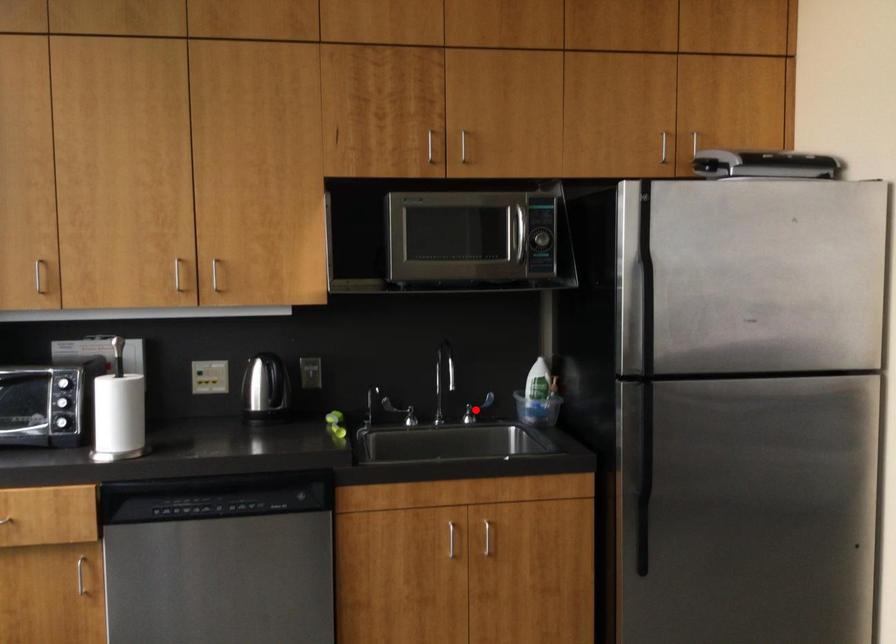
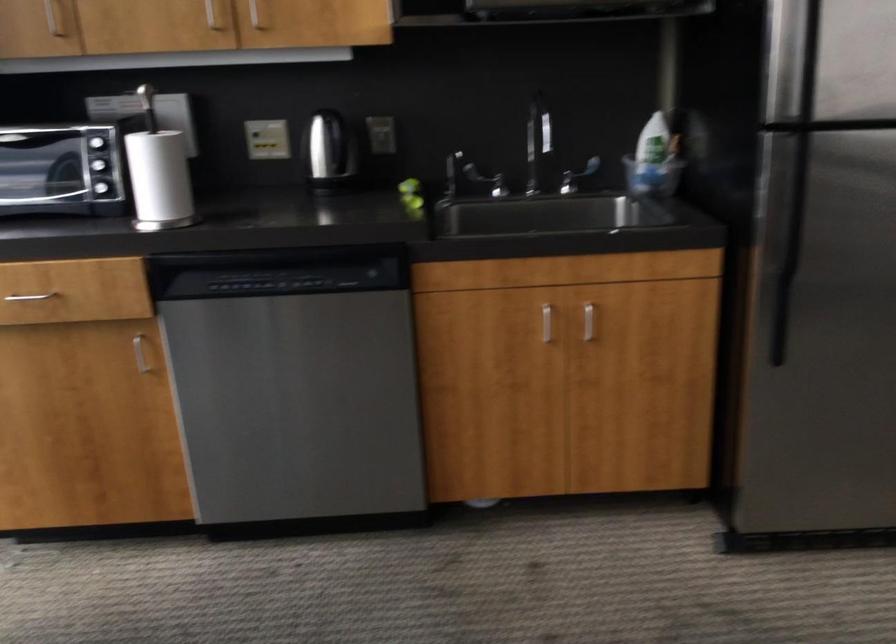
Question: A red point is marked in image1. In image2, is the corresponding 3D point closer to the camera or farther? Reply with the corresponding letter.

Choices:
 (A) The corresponding 3D point is closer.
 (B) The corresponding 3D point is farther.

Answer: (A)